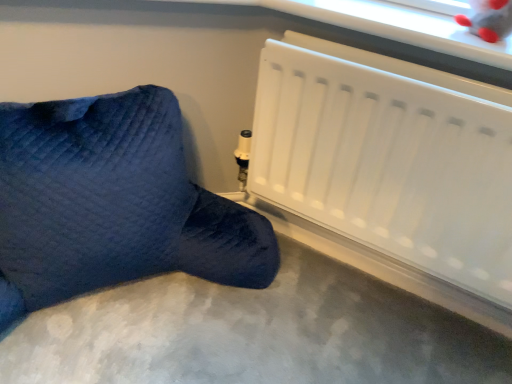
This screenshot has height=384, width=512. In order to click on free spot to the right of velvety blue bean bag at lower left in this screenshot , I will do `click(298, 337)`.